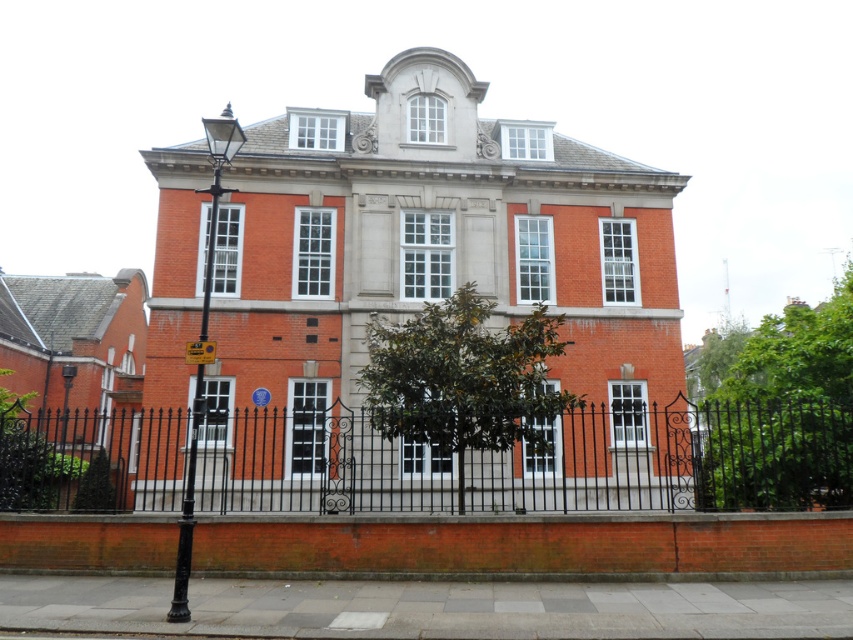
Between black wrought iron fence at center and yellow plastic sign at lower left, which one is positioned higher?

yellow plastic sign at lower left is above.

Is point (767, 417) closer to camera compared to point (206, 355)?

That is False.

Locate an element on the screen. The width and height of the screenshot is (853, 640). black wrought iron fence at center is located at coordinates click(537, 461).

Image resolution: width=853 pixels, height=640 pixels. I want to click on black wrought iron fence at center, so click(x=537, y=461).